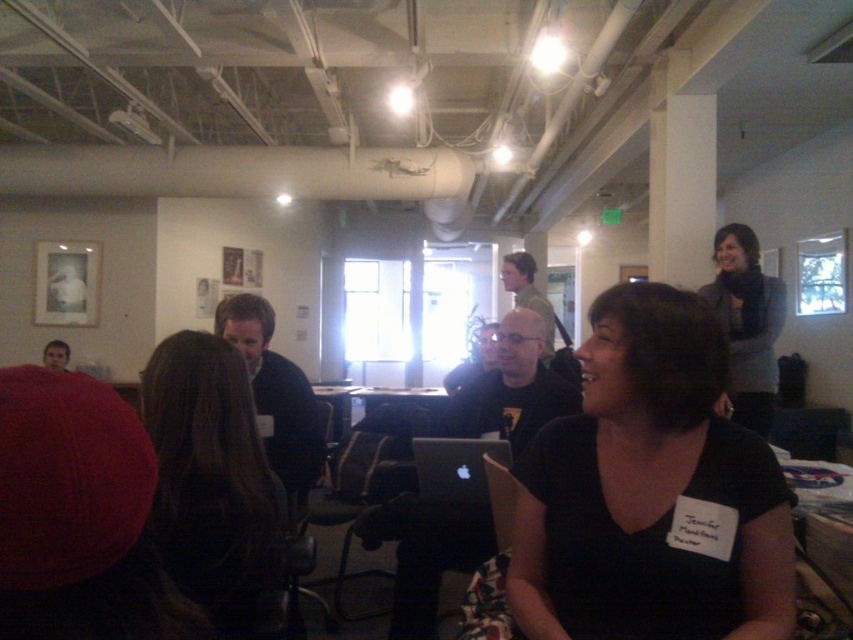
You are organizing a photo shoot in this room and need to ensure that the gray wool sweater at upper right and the black matte laptop at center are both visible in the frame. Given their sizes, which object might require you to adjust the camera angle to include it properly?

The gray wool sweater at upper right is much taller than the black matte laptop at center, so you may need to adjust the camera angle to accommodate its height to ensure it fits within the frame.